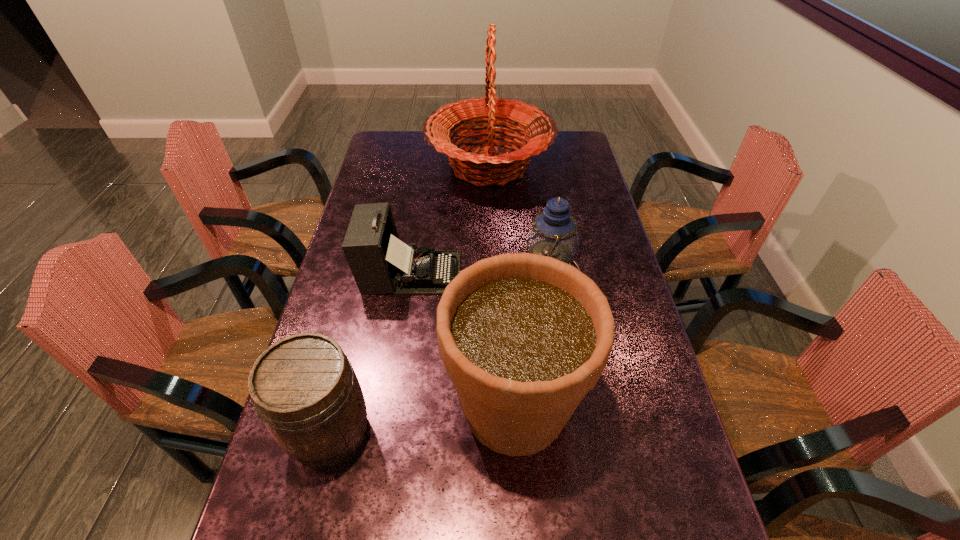
Image resolution: width=960 pixels, height=540 pixels. I want to click on basket, so click(478, 167).

Identify the location of the farthest object. The height and width of the screenshot is (540, 960). (478, 167).

Where is `the fourth shortest object`? This screenshot has width=960, height=540. the fourth shortest object is located at coordinates (524, 337).

This screenshot has width=960, height=540. Find the location of `lantern`. lantern is located at coordinates (553, 233).

Find the location of a particular element. This screenshot has width=960, height=540. cider is located at coordinates click(x=305, y=390).

Locate an element on the screen. The width and height of the screenshot is (960, 540). the shortest object is located at coordinates [380, 262].

This screenshot has height=540, width=960. What are the coordinates of `free location located 0.180m on the front of the basket` in the screenshot? It's located at (492, 237).

Locate an element on the screen. This screenshot has width=960, height=540. free space located 0.280m on the back of the flowerpot is located at coordinates (507, 273).

Locate an element on the screen. Image resolution: width=960 pixels, height=540 pixels. vacant space located on the front-facing side of the lantern is located at coordinates (439, 273).

You are a GUI agent. You are given a task and a screenshot of the screen. Output one action in this format:
    pyautogui.click(x=<x>, y=<y>)
    Task: Click on the blank area located 0.070m on the front-facing side of the lantern
    This screenshot has height=540, width=960.
    Given the screenshot: What is the action you would take?
    pyautogui.click(x=492, y=273)